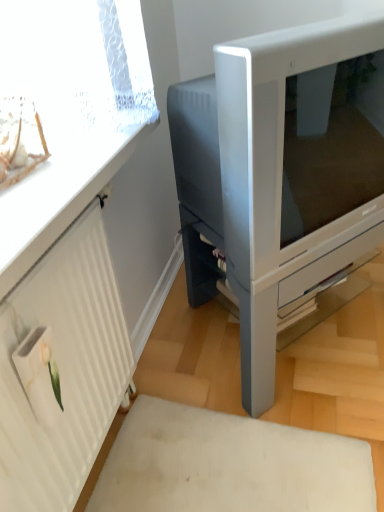
Question: From the image's perspective, does white textured radiator at left appear lower than satin silver monitor at center?

Choices:
 (A) no
 (B) yes

Answer: (B)

Question: From the image's perspective, does white textured radiator at left appear higher than satin silver monitor at center?

Choices:
 (A) no
 (B) yes

Answer: (A)

Question: Is white textured radiator at left positioned behind satin silver monitor at center?

Choices:
 (A) yes
 (B) no

Answer: (B)

Question: Is white textured radiator at left looking in the opposite direction of satin silver monitor at center?

Choices:
 (A) yes
 (B) no

Answer: (B)

Question: Is white textured radiator at left outside satin silver monitor at center?

Choices:
 (A) yes
 (B) no

Answer: (A)

Question: Does white textured radiator at left have a smaller size compared to satin silver monitor at center?

Choices:
 (A) no
 (B) yes

Answer: (B)

Question: Could you tell me if satin silver monitor at center is facing white textured radiator at left?

Choices:
 (A) yes
 (B) no

Answer: (B)

Question: Is satin silver monitor at center wider than white textured radiator at left?

Choices:
 (A) no
 (B) yes

Answer: (B)

Question: From a real-world perspective, is satin silver monitor at center over white textured radiator at left?

Choices:
 (A) no
 (B) yes

Answer: (A)

Question: Can you confirm if satin silver monitor at center is positioned to the left of white textured radiator at left?

Choices:
 (A) yes
 (B) no

Answer: (B)

Question: Is satin silver monitor at center not within white textured radiator at left?

Choices:
 (A) yes
 (B) no

Answer: (A)

Question: Are satin silver monitor at center and white textured radiator at left far apart?

Choices:
 (A) no
 (B) yes

Answer: (A)

Question: From the image's perspective, is satin silver monitor at center located above clear plastic window screen at upper left?

Choices:
 (A) no
 (B) yes

Answer: (A)